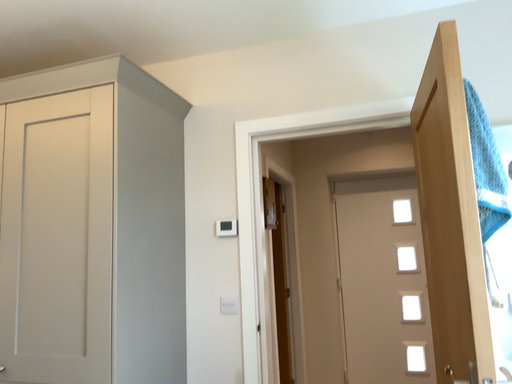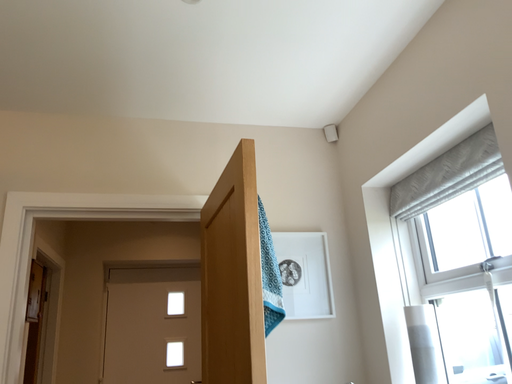
Question: Which way did the camera rotate in the video?

Choices:
 (A) rotated upward
 (B) rotated downward

Answer: (A)